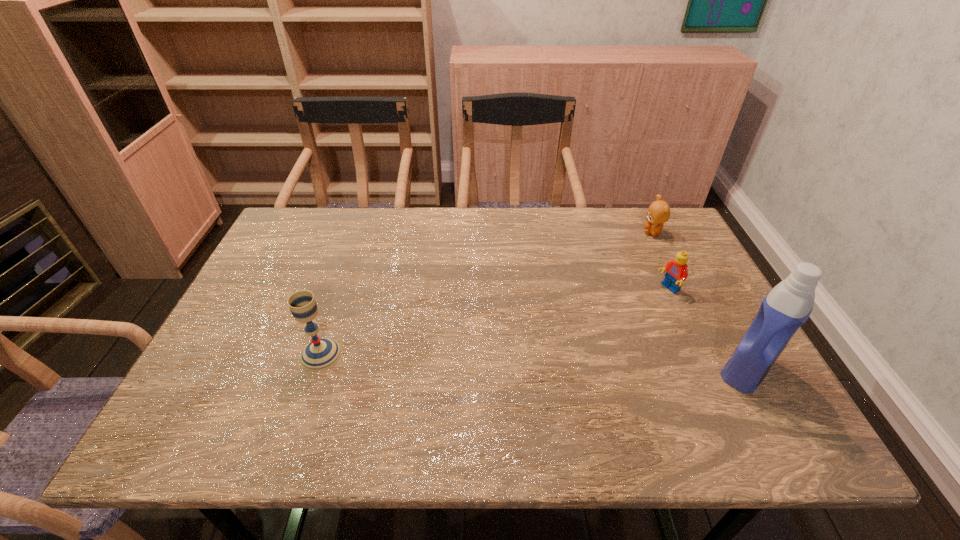
Locate an element on the screen. empty space between the tallest object and the second farthest object is located at coordinates [x=708, y=329].

Where is `vacant area that lies between the tallest object and the third nearest object`? vacant area that lies between the tallest object and the third nearest object is located at coordinates (708, 329).

The width and height of the screenshot is (960, 540). I want to click on free spot between the leftmost object and the tallest object, so click(x=534, y=362).

I want to click on free point between the chalice and the teddy bear, so click(487, 293).

What are the coordinates of `vacant area that lies between the second farthest object and the farthest object` in the screenshot? It's located at (660, 261).

Find the location of a particular element. vacant area between the detergent and the chalice is located at coordinates (534, 362).

Locate an element on the screen. This screenshot has height=540, width=960. object that is the third closest to the leftmost object is located at coordinates (658, 213).

Select which object appears as the second closest to the detergent. Please provide its 2D coordinates. Your answer should be formatted as a tuple, i.e. [(x, y)], where the tuple contains the x and y coordinates of a point satisfying the conditions above.

[(658, 213)]

Locate an element on the screen. Image resolution: width=960 pixels, height=540 pixels. vacant space that satisfies the following two spatial constraints: 1. on the front side of the tallest object; 2. on the left side of the second tallest object is located at coordinates (316, 369).

Image resolution: width=960 pixels, height=540 pixels. I want to click on free space that satisfies the following two spatial constraints: 1. on the back side of the third shortest object; 2. on the right side of the third nearest object, so click(x=343, y=289).